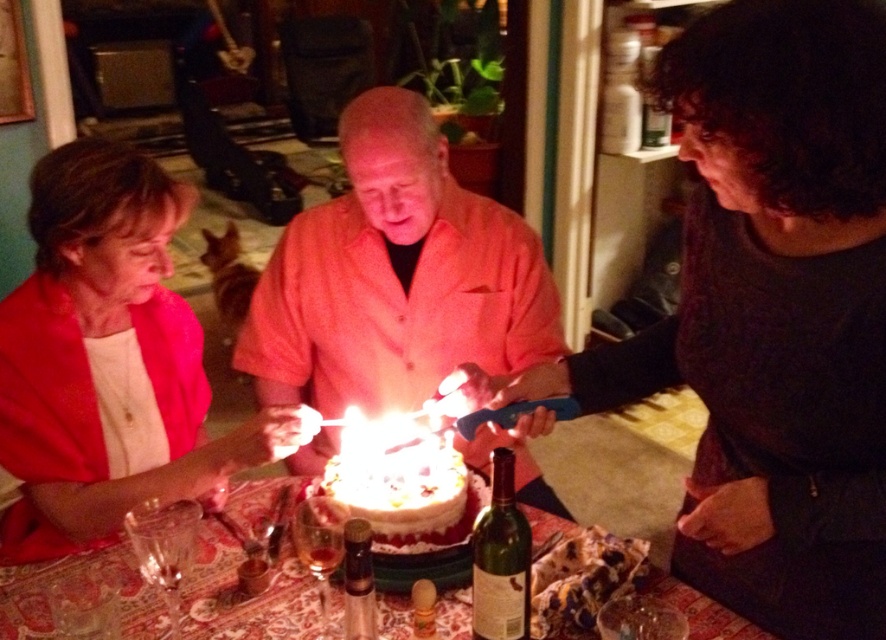
Who is more forward, (126, 444) or (394, 289)?

Point (126, 444)

Who is positioned more to the left, matte pink sweater at left or matte orange shirt at center?

Positioned to the left is matte pink sweater at left.

Which is behind, point (121, 300) or point (347, 266)?

Point (347, 266)

Image resolution: width=886 pixels, height=640 pixels. Find the location of `matte pink sweater at left`. matte pink sweater at left is located at coordinates (106, 358).

Looking at this image, can you confirm if matte pink sweater at left is positioned above white frosted cake at center?

Yes.

Is matte pink sweater at left bigger than white frosted cake at center?

Correct, matte pink sweater at left is larger in size than white frosted cake at center.

Is point (154, 282) positioned after point (465, 532)?

Yes.

What are the coordinates of `matte pink sweater at left` in the screenshot? It's located at (106, 358).

Which is behind, point (756, 632) or point (425, 536)?

Positioned behind is point (425, 536).

Where is `patterned fabric tablecloth at center`? patterned fabric tablecloth at center is located at coordinates (250, 600).

Identify the location of patterned fabric tablecloth at center. The image size is (886, 640). (250, 600).